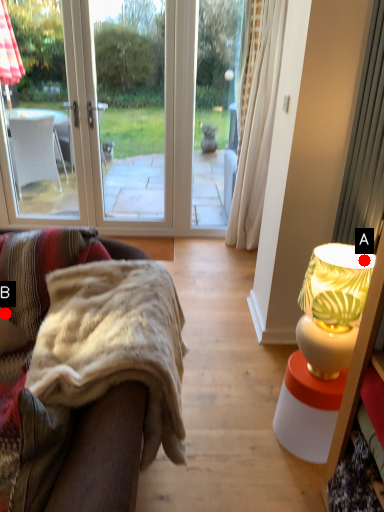
Question: Two points are circled on the image, labeled by A and B beside each circle. Which point is farther from the camera taking this photo?

Choices:
 (A) A is further
 (B) B is further

Answer: (B)